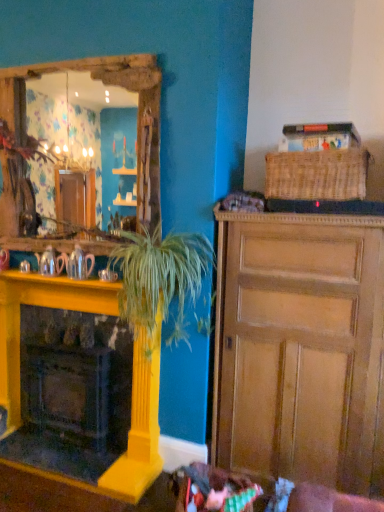
In order to face wooden cabinet at right, should I rotate leftwards or rightwards?

To align with it, rotate right about 14.763°.

Where is `matte silver coffee cup at lower left`? The width and height of the screenshot is (384, 512). matte silver coffee cup at lower left is located at coordinates (107, 275).

Locate an element on the screen. Image resolution: width=384 pixels, height=512 pixels. woven brown picnic basket at upper right is located at coordinates (317, 175).

Locate an element on the screen. shiny silver teapot at left, the first teapot viewed from the left is located at coordinates (50, 262).

This screenshot has height=512, width=384. Identify the location of wooden cabinet at right. (300, 349).

Is green leafy plant at center further to camera compared to woven brown picnic basket at upper right?

No, green leafy plant at center is closer to the viewer.

Does point (194, 240) appear closer or farther from the camera than point (289, 192)?

Point (194, 240) is farther from the camera than point (289, 192).

Are wooden cabinet at center and green leafy plant at center located far from each other?

That's not correct — wooden cabinet at center is a little close to green leafy plant at center.

Is wooden cabinet at center closer to camera compared to green leafy plant at center?

No, it is not.

Considering the sizes of wooden cabinet at center and green leafy plant at center in the image, is wooden cabinet at center taller or shorter than green leafy plant at center?

wooden cabinet at center is taller than green leafy plant at center.

Which is farther from the camera, (80, 67) or (150, 328)?

The point (80, 67) is farther.

Which object is positioned more to the right, shiny silver teapot at left, the 2th teapot from the right, or matte silver teapot at left, the 1th teapot when ordered from right to left?

From the viewer's perspective, matte silver teapot at left, the 1th teapot when ordered from right to left, appears more on the right side.

From a real-world perspective, which is physically above, shiny silver teapot at left, the first teapot viewed from the left, or matte silver teapot at left, arranged as the second teapot when viewed from the left?

matte silver teapot at left, arranged as the second teapot when viewed from the left.

Locate an element on the screen. teapot located below the shiny silver teapot at left, the first teapot viewed from the left (from the image's perspective) is located at coordinates coord(79,264).

Is shiny silver teapot at left, the 2th teapot from the right, inside or outside of matte silver teapot at left, arranged as the second teapot when viewed from the left?

The correct answer is: outside.

Is point (277, 187) closer or farther from the camera than point (107, 84)?

Point (277, 187) is positioned closer to the camera compared to point (107, 84).

Choose the correct answer: Is woven brown picnic basket at upper right inside wooden cabinet at center or outside it?

woven brown picnic basket at upper right is not inside wooden cabinet at center, it's outside.

Are woven brown picnic basket at upper right and wooden cabinet at center located far from each other?

woven brown picnic basket at upper right is near wooden cabinet at center, not far away.

Considering the relative positions of woven brown picnic basket at upper right and wooden cabinet at center in the image provided, is woven brown picnic basket at upper right in front of wooden cabinet at center?

Yes, it is.

Which is correct: woven brown picnic basket at upper right is inside yellow painted wood fireplace at left, or outside of it?

woven brown picnic basket at upper right is outside yellow painted wood fireplace at left.

From the image's perspective, which object appears higher, woven brown picnic basket at upper right or yellow painted wood fireplace at left?

woven brown picnic basket at upper right appears higher in the image.

In the scene shown: Visually, is woven brown picnic basket at upper right positioned to the left or to the right of yellow painted wood fireplace at left?

woven brown picnic basket at upper right is to the right of yellow painted wood fireplace at left.

In the scene shown: What's the angular difference between woven brown picnic basket at upper right and yellow painted wood fireplace at left's facing directions?

There is a 0.275-degree angle between the facing directions of woven brown picnic basket at upper right and yellow painted wood fireplace at left.

Considering the relative sizes of wooden cabinet at right and woven brown picnic basket at upper right in the image provided, is wooden cabinet at right thinner than woven brown picnic basket at upper right?

No, wooden cabinet at right is not thinner than woven brown picnic basket at upper right.

Could you tell me if wooden cabinet at right is turned towards woven brown picnic basket at upper right?

No, wooden cabinet at right is not aimed at woven brown picnic basket at upper right.

Which object is more forward, wooden cabinet at right or woven brown picnic basket at upper right?

wooden cabinet at right.

Looking at this image, is wooden cabinet at right far from woven brown picnic basket at upper right?

wooden cabinet at right is near woven brown picnic basket at upper right, not far away.

Based on the photo, from the image's perspective, is yellow painted wood fireplace at left on shiny silver teapot at left, the 2th teapot from the right?

No, from the image's perspective, yellow painted wood fireplace at left is not above shiny silver teapot at left, the 2th teapot from the right.

In the scene shown: Who is more distant, yellow painted wood fireplace at left or shiny silver teapot at left, the 2th teapot from the right?

shiny silver teapot at left, the 2th teapot from the right, is more distant.

From a real-world perspective, is yellow painted wood fireplace at left on shiny silver teapot at left, the first teapot viewed from the left?

Incorrect, from a real-world perspective, yellow painted wood fireplace at left is lower than shiny silver teapot at left, the first teapot viewed from the left.

Identify the location of houseplant located underneath the woven brown picnic basket at upper right (from a real-world perspective). The height and width of the screenshot is (512, 384). (159, 276).

There is a green leafy plant at center. Where is `cabinetry above it (from a real-world perspective)`? The width and height of the screenshot is (384, 512). cabinetry above it (from a real-world perspective) is located at coordinates (105, 84).

Estimate the real-world distances between objects in this image. Which object is further from wooden cabinet at right, yellow painted wood fireplace at left or wooden cabinet at center?

yellow painted wood fireplace at left is further to wooden cabinet at right.

Consider the image. Based on their spatial positions, is yellow painted wood fireplace at left or matte silver coffee cup at lower left closer to green leafy plant at center?

matte silver coffee cup at lower left is closer to green leafy plant at center.

Which object lies further to the anchor point green leafy plant at center, matte silver coffee cup at lower left or matte silver teapot at left, arranged as the second teapot when viewed from the left?

The object further to green leafy plant at center is matte silver teapot at left, arranged as the second teapot when viewed from the left.

Estimate the real-world distances between objects in this image. Which object is further from wooden cabinet at right, woven brown picnic basket at upper right or green leafy plant at center?

woven brown picnic basket at upper right.

Based on their spatial positions, is wooden cabinet at right or yellow painted wood fireplace at left closer to matte silver coffee cup at lower left?

A: Based on the image, yellow painted wood fireplace at left appears to be nearer to matte silver coffee cup at lower left.

When comparing their distances from wooden cabinet at center, does woven brown picnic basket at upper right or matte silver coffee cup at lower left seem closer?

Based on the image, matte silver coffee cup at lower left appears to be nearer to wooden cabinet at center.

Which object lies nearer to the anchor point matte silver teapot at left, the 1th teapot when ordered from right to left, matte silver coffee cup at lower left or wooden cabinet at center?

Among the two, matte silver coffee cup at lower left is located nearer to matte silver teapot at left, the 1th teapot when ordered from right to left.

Which object lies nearer to the anchor point yellow painted wood fireplace at left, matte silver teapot at left, the 1th teapot when ordered from right to left, or woven brown picnic basket at upper right?

matte silver teapot at left, the 1th teapot when ordered from right to left, is positioned closer to the anchor yellow painted wood fireplace at left.

Locate an element on the screen. The image size is (384, 512). coffee cup between yellow painted wood fireplace at left and wooden cabinet at right is located at coordinates (107, 275).

Locate an element on the screen. The width and height of the screenshot is (384, 512). houseplant between shiny silver teapot at left, the first teapot viewed from the left, and wooden cabinet at right is located at coordinates (159, 276).

You are a GUI agent. You are given a task and a screenshot of the screen. Output one action in this format:
    pyautogui.click(x=<x>, y=<y>)
    Task: Click on the houseplant between matte silver coffee cup at lower left and yellow painted wood fireplace at left in the vertical direction
    The width and height of the screenshot is (384, 512).
    Given the screenshot: What is the action you would take?
    pyautogui.click(x=159, y=276)

This screenshot has height=512, width=384. What are the coordinates of `coffee cup situated between wooden cabinet at center and wooden cabinet at right from left to right` in the screenshot? It's located at tap(107, 275).